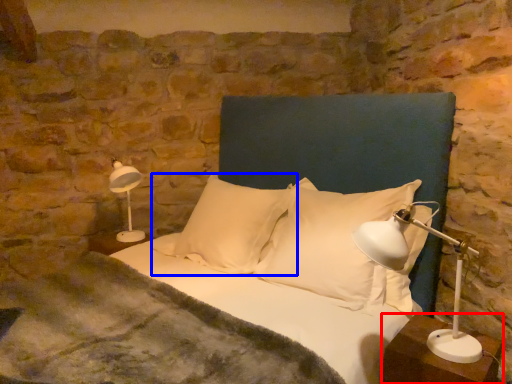
Question: Among these objects, which one is farthest to the camera, nightstand (highlighted by a red box) or pillow (highlighted by a blue box)?

Choices:
 (A) nightstand
 (B) pillow

Answer: (B)